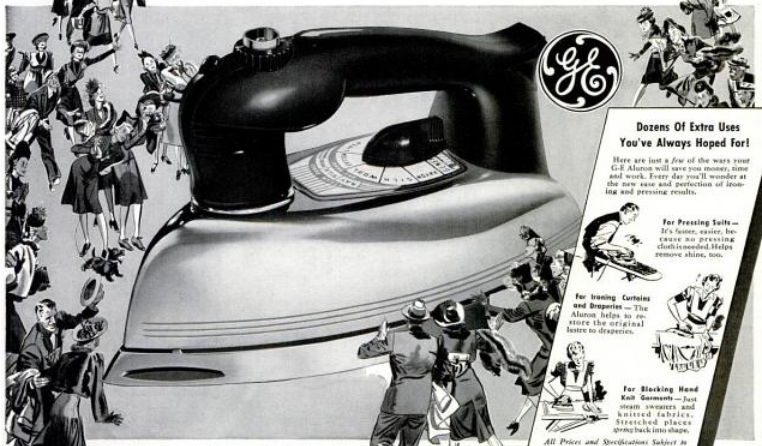
Image resolution: width=762 pixels, height=446 pixels. Identify the location of off/on button. (255, 52).